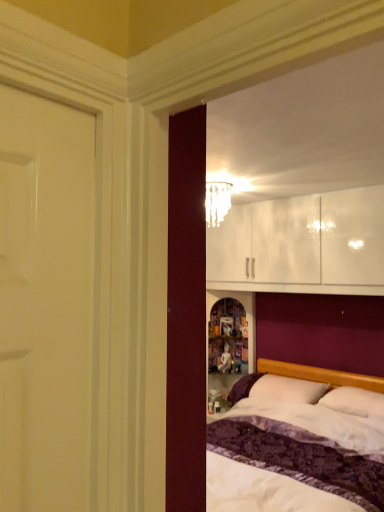
Question: Does translucent glass chandelier at upper center have a lesser height compared to white soft pillow at center, which ranks as the first pillow in right-to-left order?

Choices:
 (A) yes
 (B) no

Answer: (B)

Question: Can you confirm if translucent glass chandelier at upper center is bigger than white soft pillow at center, arranged as the second pillow when viewed from the left?

Choices:
 (A) no
 (B) yes

Answer: (A)

Question: Is translucent glass chandelier at upper center positioned before white soft pillow at center, arranged as the second pillow when viewed from the left?

Choices:
 (A) yes
 (B) no

Answer: (A)

Question: Is translucent glass chandelier at upper center oriented towards white soft pillow at center, which ranks as the first pillow in right-to-left order?

Choices:
 (A) no
 (B) yes

Answer: (A)

Question: Considering the relative sizes of translucent glass chandelier at upper center and white soft pillow at center, arranged as the second pillow when viewed from the left, in the image provided, is translucent glass chandelier at upper center thinner than white soft pillow at center, arranged as the second pillow when viewed from the left,?

Choices:
 (A) yes
 (B) no

Answer: (A)

Question: Relative to white soft pillow at lower right, the second pillow in the right-to-left sequence, is translucent glass chandelier at upper center in front or behind?

Choices:
 (A) behind
 (B) front

Answer: (B)

Question: Is translucent glass chandelier at upper center situated inside white soft pillow at lower right, the first pillow when ordered from left to right, or outside?

Choices:
 (A) inside
 (B) outside

Answer: (B)

Question: Does point (230, 187) appear closer or farther from the camera than point (294, 392)?

Choices:
 (A) farther
 (B) closer

Answer: (B)

Question: Based on their sizes in the image, would you say translucent glass chandelier at upper center is bigger or smaller than white soft pillow at lower right, the second pillow in the right-to-left sequence?

Choices:
 (A) small
 (B) big

Answer: (A)

Question: Looking at their shapes, would you say white soft pillow at center, arranged as the second pillow when viewed from the left, is wider or thinner than white soft pillow at lower right, the first pillow when ordered from left to right?

Choices:
 (A) wide
 (B) thin

Answer: (B)

Question: Does point (350, 388) appear closer or farther from the camera than point (259, 390)?

Choices:
 (A) farther
 (B) closer

Answer: (B)

Question: From the image's perspective, is white soft pillow at center, arranged as the second pillow when viewed from the left, located above or below white soft pillow at lower right, the first pillow when ordered from left to right?

Choices:
 (A) below
 (B) above

Answer: (B)

Question: Is white soft pillow at center, which ranks as the first pillow in right-to-left order, bigger or smaller than white soft pillow at lower right, the second pillow in the right-to-left sequence?

Choices:
 (A) big
 (B) small

Answer: (B)

Question: In terms of width, does white soft pillow at lower right, the second pillow in the right-to-left sequence, look wider or thinner when compared to white soft pillow at center, arranged as the second pillow when viewed from the left?

Choices:
 (A) wide
 (B) thin

Answer: (A)

Question: In the image, is white soft pillow at lower right, the second pillow in the right-to-left sequence, positioned in front of or behind white soft pillow at center, which ranks as the first pillow in right-to-left order?

Choices:
 (A) front
 (B) behind

Answer: (B)